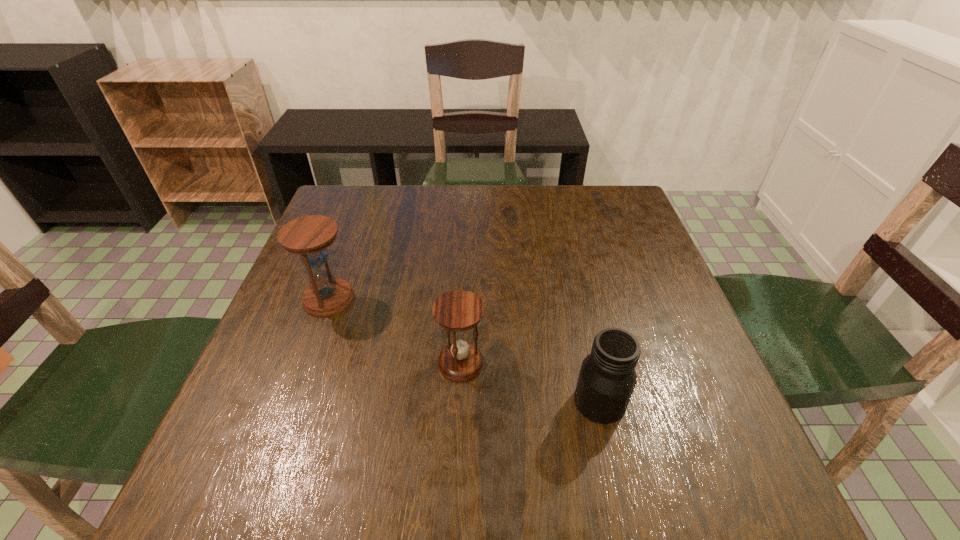
Image resolution: width=960 pixels, height=540 pixels. Find the location of `free space that is in between the shorter hourglass and the left hourglass`. free space that is in between the shorter hourglass and the left hourglass is located at coordinates (395, 331).

Locate an element on the screen. free spot between the jar and the right hourglass is located at coordinates (530, 382).

This screenshot has height=540, width=960. What are the coordinates of `object that can be found as the closest to the leftmost object` in the screenshot? It's located at (457, 311).

Identify which object is the nearest to the shorter hourglass. Please provide its 2D coordinates. Your answer should be formatted as a tuple, i.e. [(x, y)], where the tuple contains the x and y coordinates of a point satisfying the conditions above.

[(607, 378)]

Identify the location of vacant space that satisfies the following two spatial constraints: 1. on the front side of the left hourglass; 2. on the right side of the rightmost object. This screenshot has height=540, width=960. (x=292, y=402).

This screenshot has width=960, height=540. I want to click on vacant space that satisfies the following two spatial constraints: 1. on the front side of the jar; 2. on the right side of the farthest object, so point(292,402).